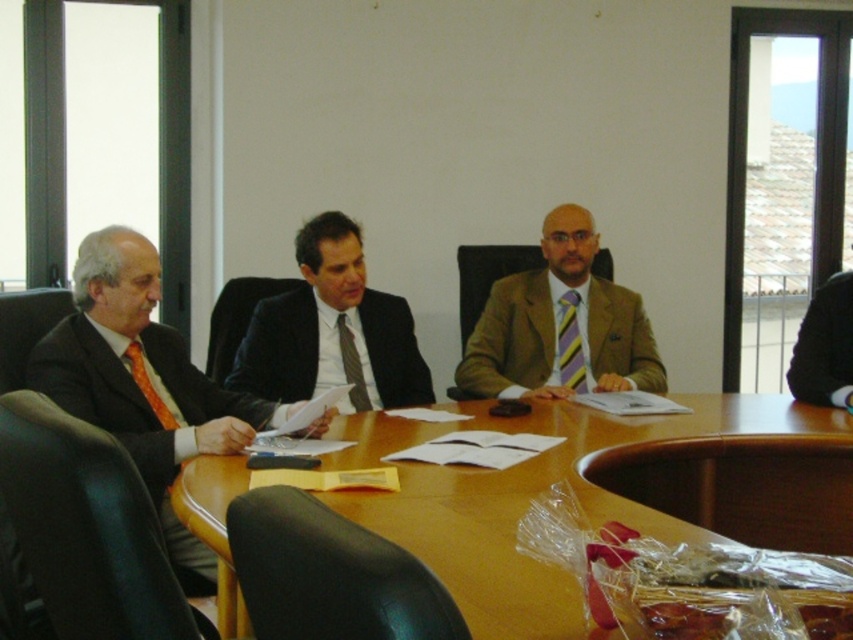
You are a tailor observing a formal meeting. You need to determine which item is higher in position between the dark gray suit at right and the striped silk tie at center. Based on the scene description, which one is taller?

The dark gray suit at right is taller than the striped silk tie at center.

You are a photographer in the conference room and want to take a photo of the matte black suit at center and the yellow striped tie at center. Which object should you focus on first if you want to ensure both are in sharp focus?

You should focus on the matte black suit at center first because it is closer to the camera than the yellow striped tie at center, ensuring both will be in focus when focusing on the closer object.

In the conference room scene, there are two items of clothing visible on the men. The dark gray suit at right and the orange silk tie at left. Which of these two items is wider?

The dark gray suit at right is wider than the orange silk tie at left.